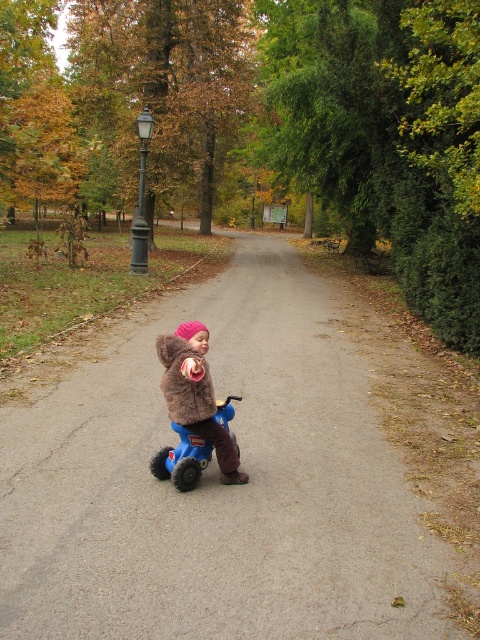
Based on the photo, who is positioned more to the right, gray asphalt path at center or green painted metal lamp post at upper left?

gray asphalt path at center is more to the right.

Is the position of gray asphalt path at center less distant than that of green painted metal lamp post at upper left?

Yes, it is in front of green painted metal lamp post at upper left.

Measure the distance between point (408,634) and camera.

The distance of point (408,634) from camera is 3.31 meters.

Where is `gray asphalt path at center`? This screenshot has height=640, width=480. gray asphalt path at center is located at coordinates (217, 483).

Does blue rubber toy car at center appear on the right side of green painted metal lamp post at upper left?

Yes, blue rubber toy car at center is to the right of green painted metal lamp post at upper left.

How far apart are blue rubber toy car at center and green painted metal lamp post at upper left?

blue rubber toy car at center is 11.86 meters away from green painted metal lamp post at upper left.

What do you see at coordinates (181, 460) in the screenshot? I see `blue rubber toy car at center` at bounding box center [181, 460].

Find the location of a particular element. The image size is (480, 640). blue rubber toy car at center is located at coordinates (181, 460).

In the scene shown: Can you confirm if gray asphalt path at center is positioned above matte blue tricycle at center?

No.

Describe the element at coordinates (217, 483) in the screenshot. I see `gray asphalt path at center` at that location.

Image resolution: width=480 pixels, height=640 pixels. I want to click on gray asphalt path at center, so click(217, 483).